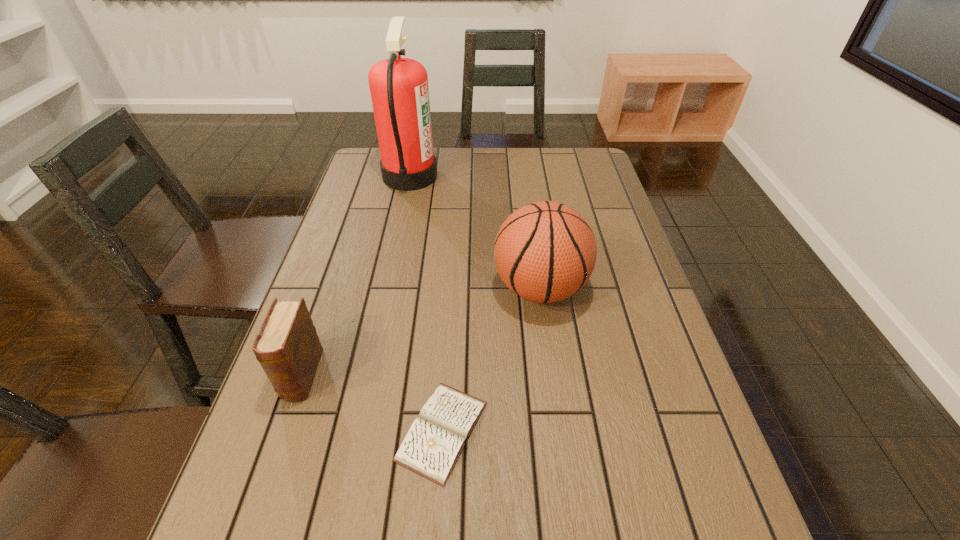
I want to click on free space that satisfies the following two spatial constraints: 1. on the spine side of the right diary; 2. on the left side of the left diary, so click(x=283, y=431).

Where is `free spot that satisfies the following two spatial constraints: 1. on the spine side of the right diary; 2. on the right side of the left diary`? free spot that satisfies the following two spatial constraints: 1. on the spine side of the right diary; 2. on the right side of the left diary is located at coordinates (283, 431).

At what (x,y) coordinates should I click in order to perform the action: click on free space that satisfies the following two spatial constraints: 1. on the side where the inflation valve is located; 2. on the front side of the shorter diary. Please return your answer as a coordinate pair (x, y). This screenshot has height=540, width=960. Looking at the image, I should click on (560, 431).

Locate an element on the screen. vacant space that satisfies the following two spatial constraints: 1. at the nozzle of the fire extinguisher; 2. on the left side of the right diary is located at coordinates (355, 431).

At what (x,y) coordinates should I click in order to perform the action: click on free point that satisfies the following two spatial constraints: 1. at the nozzle of the tallest object; 2. on the right side of the shorter diary. Please return your answer as a coordinate pair (x, y). Looking at the image, I should click on (355, 431).